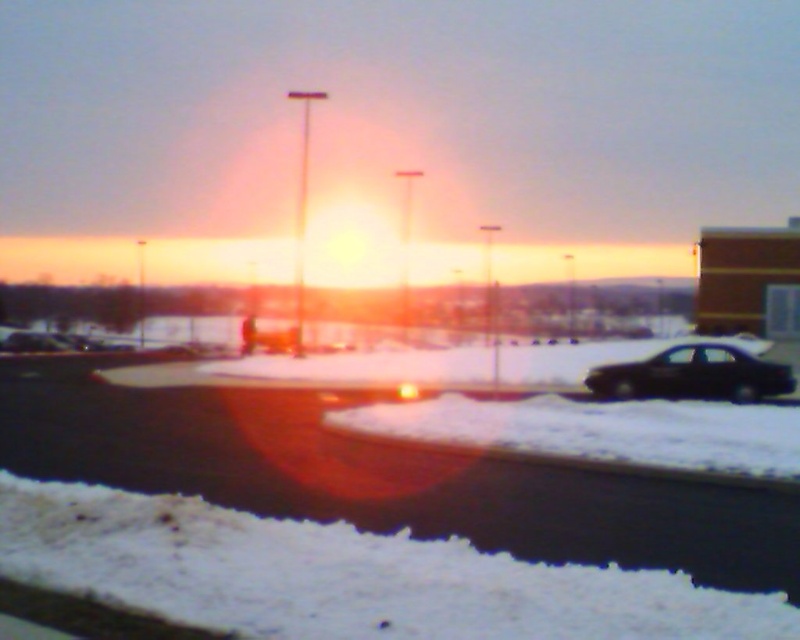
Question: Can you confirm if white fluffy snow at lower left is wider than black matte car at right?

Choices:
 (A) yes
 (B) no

Answer: (B)

Question: Which object appears farthest from the camera in this image?

Choices:
 (A) white fluffy snow at lower left
 (B) black matte car at right

Answer: (B)

Question: Which point appears farthest from the camera in this image?

Choices:
 (A) (417, 609)
 (B) (666, 365)

Answer: (B)

Question: Does white fluffy snow at lower left appear under black matte car at right?

Choices:
 (A) no
 (B) yes

Answer: (B)

Question: Does white fluffy snow at lower left have a larger size compared to black matte car at right?

Choices:
 (A) no
 (B) yes

Answer: (A)